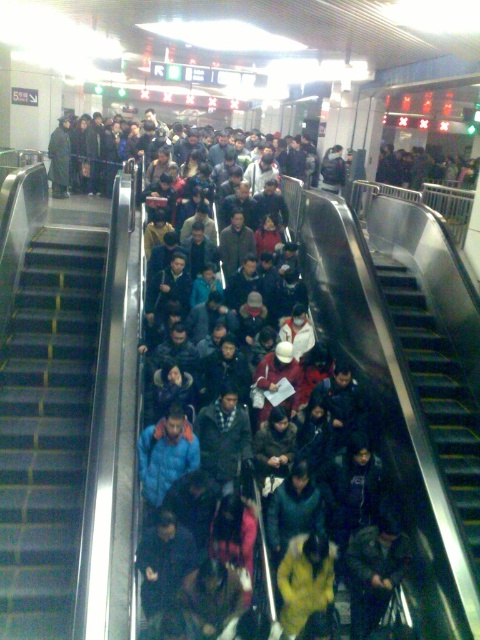
Question: Can you confirm if metallic gray stairs at left is positioned above dark blue jacket at center?

Choices:
 (A) no
 (B) yes

Answer: (A)

Question: Which point appears closest to the camera in this image?

Choices:
 (A) (448, 442)
 (B) (409, 420)

Answer: (B)

Question: Does metallic gray stairs at left appear under metallic silver escalator at center?

Choices:
 (A) yes
 (B) no

Answer: (B)

Question: Which object is positioned farthest from the metallic gray stairs at center?

Choices:
 (A) metallic silver escalator at center
 (B) dark blue jacket at center

Answer: (A)

Question: Which is nearer to the metallic gray stairs at left?

Choices:
 (A) dark blue jacket at center
 (B) metallic silver escalator at center
 (C) metallic gray stairs at center

Answer: (A)

Question: Can you confirm if metallic gray stairs at left is smaller than dark blue jacket at center?

Choices:
 (A) no
 (B) yes

Answer: (B)